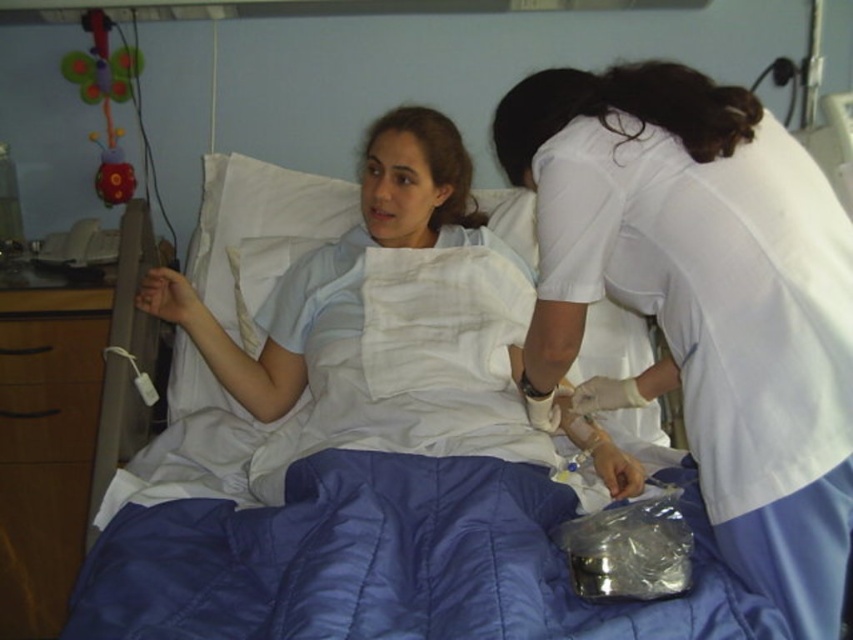
Question: Which point is farther to the camera?

Choices:
 (A) blue quilted bed at center
 (B) wooden drawer at lower left
 (C) wooden drawer at left

Answer: (B)

Question: Is white smooth uniform at center further to the viewer compared to white cotton hospital gown at center?

Choices:
 (A) yes
 (B) no

Answer: (B)

Question: Does white smooth uniform at center appear under wooden drawer at left?

Choices:
 (A) yes
 (B) no

Answer: (B)

Question: Which object is the closest to the wooden drawer at left?

Choices:
 (A) blue quilted bed at center
 (B) white cotton hospital gown at center
 (C) wooden drawer at lower left

Answer: (C)

Question: Which point is farther to the camera?

Choices:
 (A) (524, 493)
 (B) (381, 442)
 (C) (94, 440)
 (D) (83, 376)

Answer: (C)

Question: Is blue quilted bed at center thinner than wooden drawer at lower left?

Choices:
 (A) yes
 (B) no

Answer: (B)